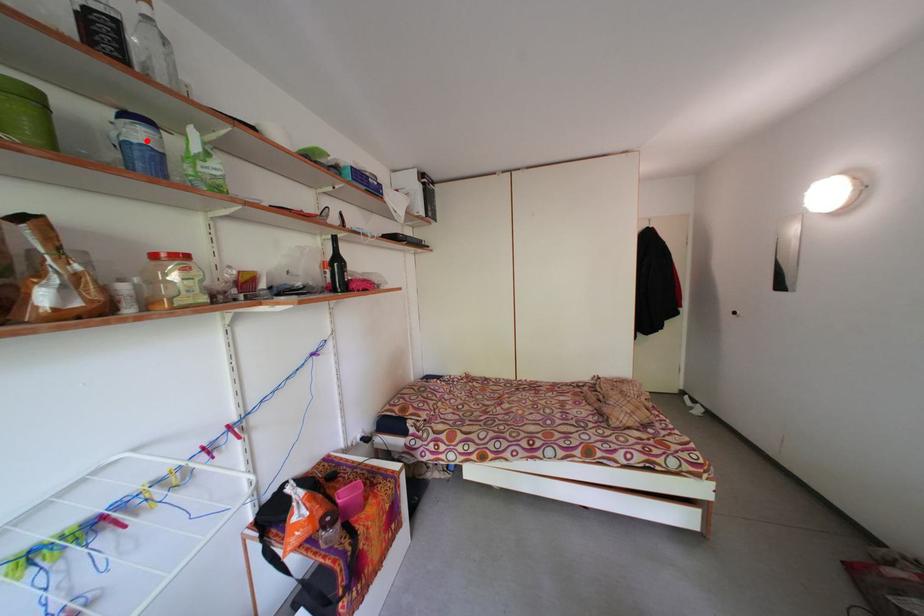
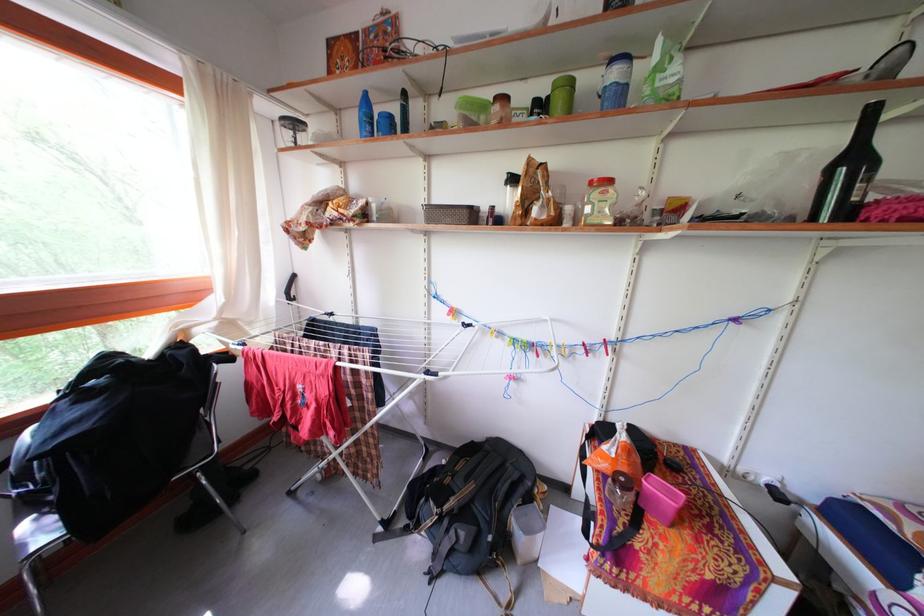
Where in the second image is the point corresponding to the highlighted location from the first image?

(623, 81)